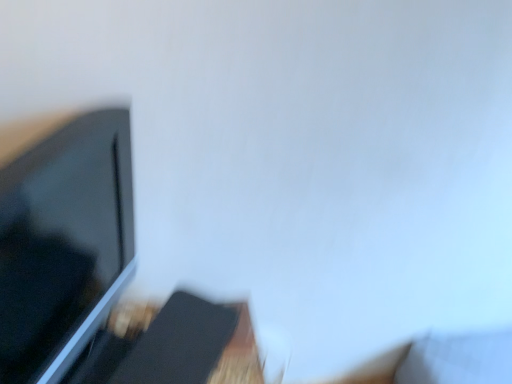
In order to click on matte black tv at left in this screenshot , I will do `click(63, 244)`.

Describe the element at coordinates (63, 244) in the screenshot. The image size is (512, 384). I see `matte black tv at left` at that location.

What is the approximate height of matte black tv at left?

46.70 centimeters.

This screenshot has height=384, width=512. I want to click on matte black tv at left, so click(63, 244).